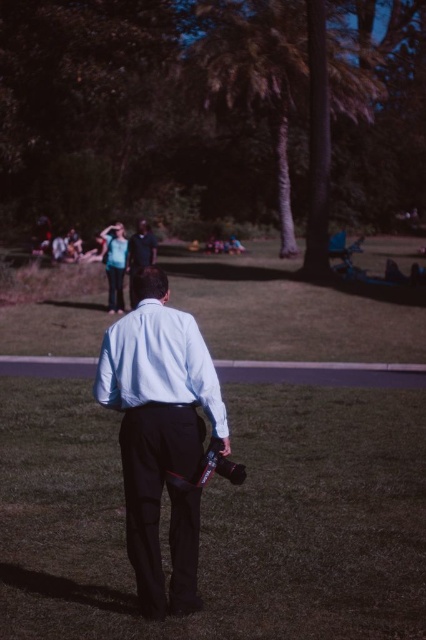
You are a photographer standing in the park and you have to take a photo that includes both the green grass at center and the light blue cotton dress shirt at center. Which object should you focus on first if you want to ensure both are in frame?

Since the green grass at center is bigger than the light blue cotton dress shirt at center, you should focus on the green grass at center first to ensure it fits within the frame, then adjust to include the smaller light blue cotton dress shirt at center.

You are a photographer in the park and want to take a picture of two people wearing the light blue cotton dress shirt at center and the matte black shirt at center. Which shirt will appear more detailed in the photo if you focus on the thinner one?

The light blue cotton dress shirt at center is thinner than the matte black shirt at center, so focusing on the thinner one will make the light blue cotton dress shirt at center appear more detailed in the photo.